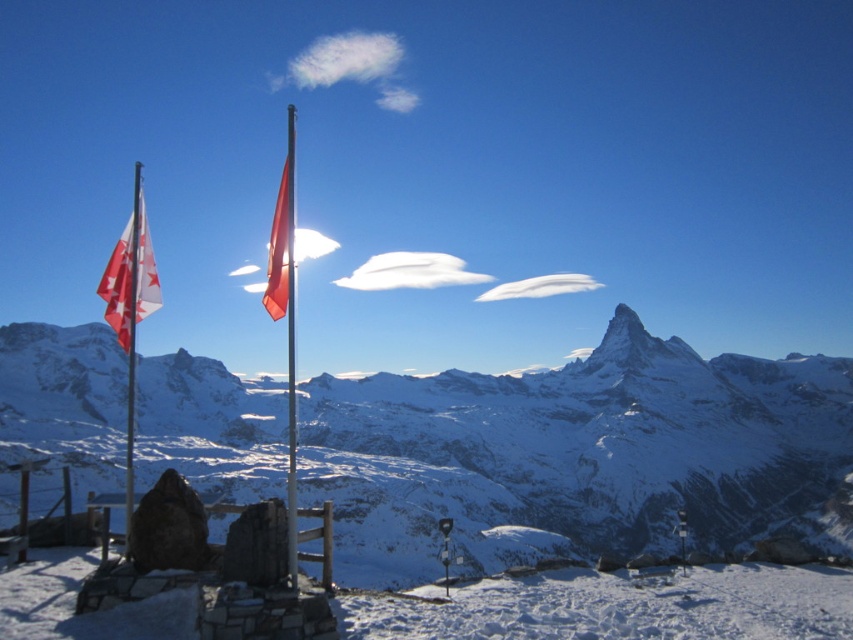
Between white snow ski slope at lower center and metallic silver flag pole at left, which one has less height?

Standing shorter between the two is white snow ski slope at lower center.

From the picture: Can you confirm if white snow ski slope at lower center is wider than metallic silver flag pole at left?

In fact, white snow ski slope at lower center might be narrower than metallic silver flag pole at left.

In order to click on white snow ski slope at lower center in this screenshot , I will do 621,608.

This screenshot has width=853, height=640. In order to click on white snow ski slope at lower center in this screenshot , I will do 621,608.

Between white snow ski slope at lower center and red fabric flag at left, which one appears on the right side from the viewer's perspective?

white snow ski slope at lower center

The height and width of the screenshot is (640, 853). What are the coordinates of `white snow ski slope at lower center` in the screenshot? It's located at (621, 608).

The image size is (853, 640). Find the location of `white snow ski slope at lower center`. white snow ski slope at lower center is located at coordinates coord(621,608).

Can you confirm if red fabric flag at left is taller than red matte flag at center?

In fact, red fabric flag at left may be shorter than red matte flag at center.

Is red fabric flag at left positioned before red matte flag at center?

That is False.

Is point (122, 310) less distant than point (277, 262)?

No, (122, 310) is further to viewer.

Where is `red fabric flag at left`? The height and width of the screenshot is (640, 853). red fabric flag at left is located at coordinates (131, 276).